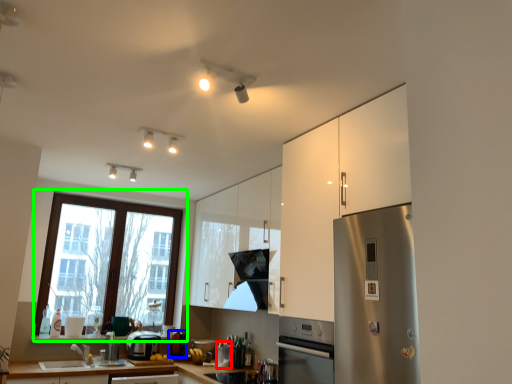
Question: Considering the real-world distances, which object is closest to appliance (highlighted by a red box)? appliance (highlighted by a blue box) or window (highlighted by a green box).

Choices:
 (A) appliance
 (B) window

Answer: (A)